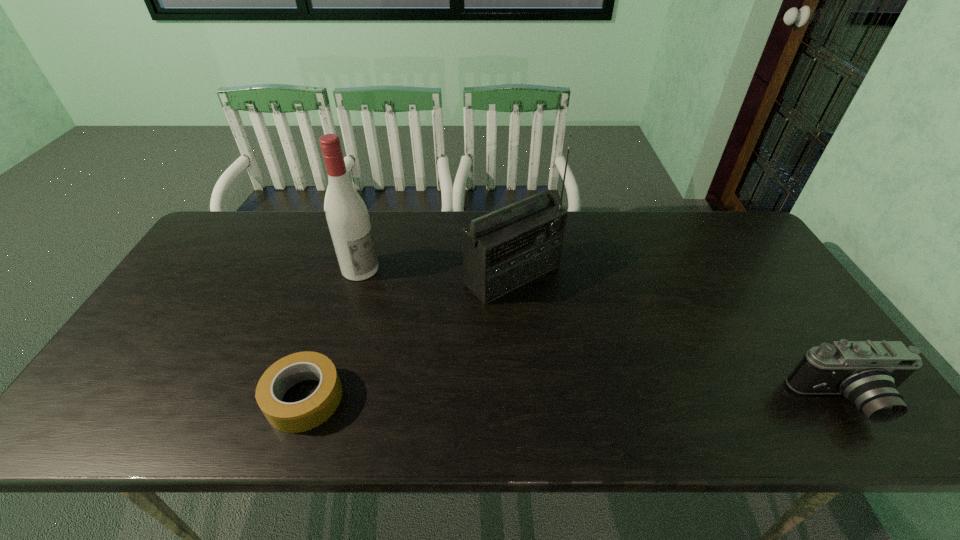
You are a GUI agent. You are given a task and a screenshot of the screen. Output one action in this format:
    pyautogui.click(x=<x>, y=<y>)
    Task: Click on the duct tape
    This screenshot has width=960, height=540.
    Given the screenshot: What is the action you would take?
    pyautogui.click(x=304, y=415)

Locate an element on the screen. The image size is (960, 540). the second shortest object is located at coordinates (867, 373).

At what (x,y) coordinates should I click in order to perform the action: click on the rightmost object. Please return your answer as a coordinate pair (x, y). Looking at the image, I should click on (867, 373).

Where is `alcohol`? alcohol is located at coordinates [347, 216].

Find the location of a particular element. This screenshot has width=960, height=540. the third object from left to right is located at coordinates (507, 248).

Find the location of a particular element. This screenshot has height=540, width=960. free region located 0.260m at the edge of the shortest object is located at coordinates (148, 399).

Locate an element on the screen. The image size is (960, 540). blank space located at the edge of the shortest object is located at coordinates (148, 399).

Locate an element on the screen. The width and height of the screenshot is (960, 540). vacant space located at the edge of the shortest object is located at coordinates (117, 399).

At what (x,y) coordinates should I click in order to perform the action: click on vacant space located 0.200m on the label of the alcohol. Please return your answer as a coordinate pair (x, y). Looking at the image, I should click on (424, 306).

You are a GUI agent. You are given a task and a screenshot of the screen. Output one action in this format:
    pyautogui.click(x=<x>, y=<y>)
    Task: Click on the vacant space located 0.150m on the label of the alcohol
    
    Given the screenshot: What is the action you would take?
    pyautogui.click(x=411, y=298)